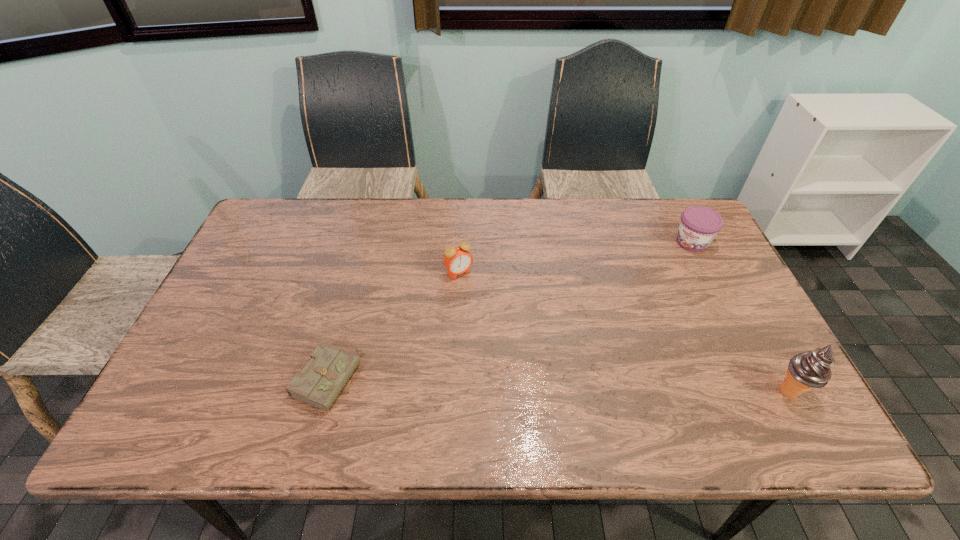
Where is `vacant space on the desktop that is between the diary and the tallest object and is positioned on the face of the third shortest object`? The height and width of the screenshot is (540, 960). vacant space on the desktop that is between the diary and the tallest object and is positioned on the face of the third shortest object is located at coordinates (541, 384).

Where is `vacant space on the desktop that is between the leftmost object and the tallest object and is positioned on the front label of the farthest object`? The height and width of the screenshot is (540, 960). vacant space on the desktop that is between the leftmost object and the tallest object and is positioned on the front label of the farthest object is located at coordinates (564, 385).